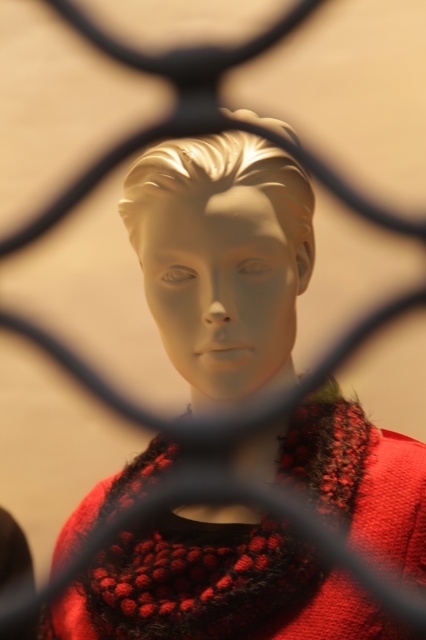
Question: Is matte white head at center to the right of knitted wool scarf at center from the viewer's perspective?

Choices:
 (A) yes
 (B) no

Answer: (A)

Question: Does matte white head at center have a smaller size compared to knitted wool scarf at center?

Choices:
 (A) no
 (B) yes

Answer: (B)

Question: Which object is closer to the camera taking this photo?

Choices:
 (A) matte white head at center
 (B) knitted wool scarf at center

Answer: (A)

Question: Does matte white head at center appear on the right side of knitted wool scarf at center?

Choices:
 (A) yes
 (B) no

Answer: (A)